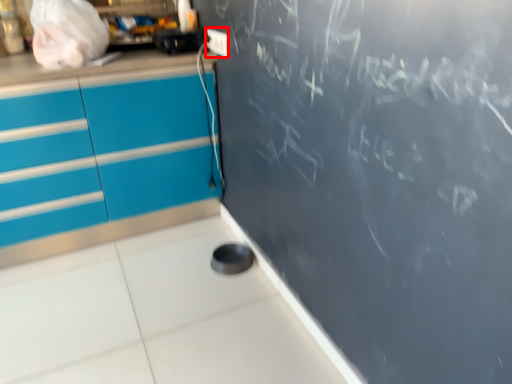
Question: From the image's perspective, what is the correct spatial relationship of electric outlet (annotated by the red box) in relation to appliance?

Choices:
 (A) below
 (B) above

Answer: (A)